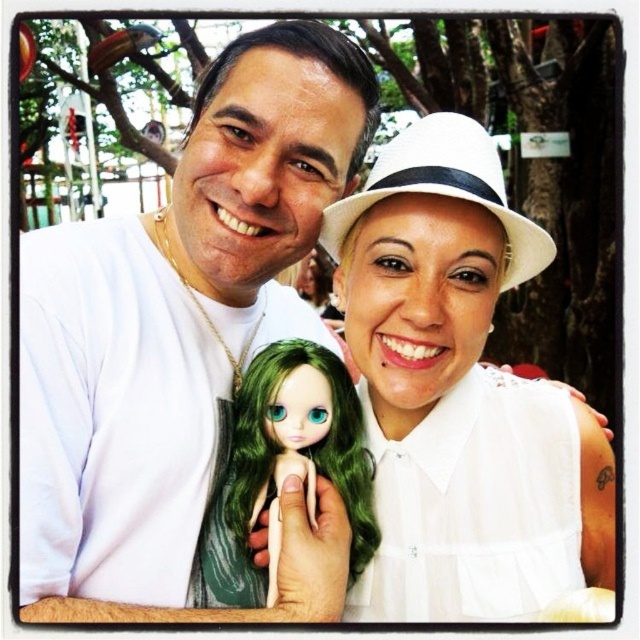
Does white matte hat at upper center have a larger size compared to green porcelain doll at center?

Correct, white matte hat at upper center is larger in size than green porcelain doll at center.

Can you confirm if white matte hat at upper center is thinner than green porcelain doll at center?

No.

Where is `white matte hat at upper center`? The height and width of the screenshot is (640, 640). white matte hat at upper center is located at coordinates (460, 394).

This screenshot has height=640, width=640. In order to click on white matte hat at upper center in this screenshot , I will do `click(460, 394)`.

Does white pleated dress at center have a larger size compared to green porcelain doll at center?

Indeed, white pleated dress at center has a larger size compared to green porcelain doll at center.

Can you confirm if white pleated dress at center is wider than green porcelain doll at center?

Correct, the width of white pleated dress at center exceeds that of green porcelain doll at center.

Which is behind, point (444, 577) or point (266, 360)?

The point (266, 360) is more distant.

Locate an element on the screen. The width and height of the screenshot is (640, 640). white pleated dress at center is located at coordinates (474, 506).

Does point (416, 548) come in front of point (400, 524)?

Yes, point (416, 548) is in front of point (400, 524).

Find the location of a particular element. The height and width of the screenshot is (640, 640). white matte hat at upper center is located at coordinates (460, 394).

This screenshot has width=640, height=640. What are the coordinates of `white matte hat at upper center` in the screenshot? It's located at (460, 394).